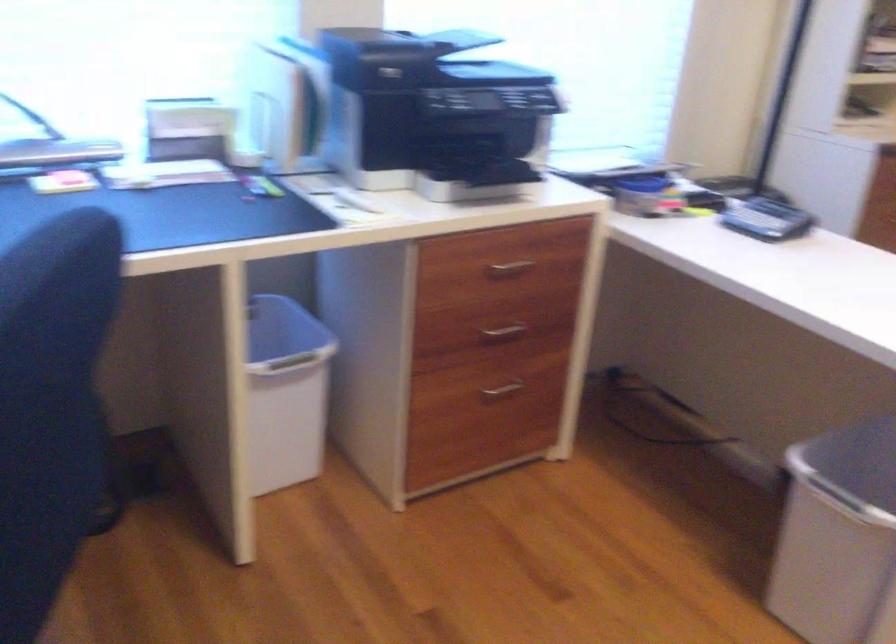
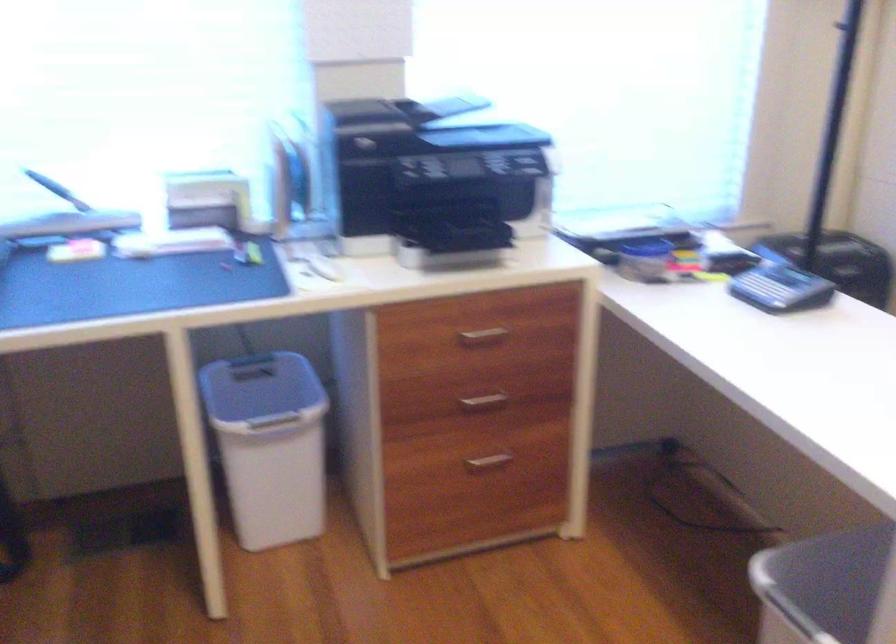
Find the pixel in the second image that matches [504,265] in the first image.

(483, 334)